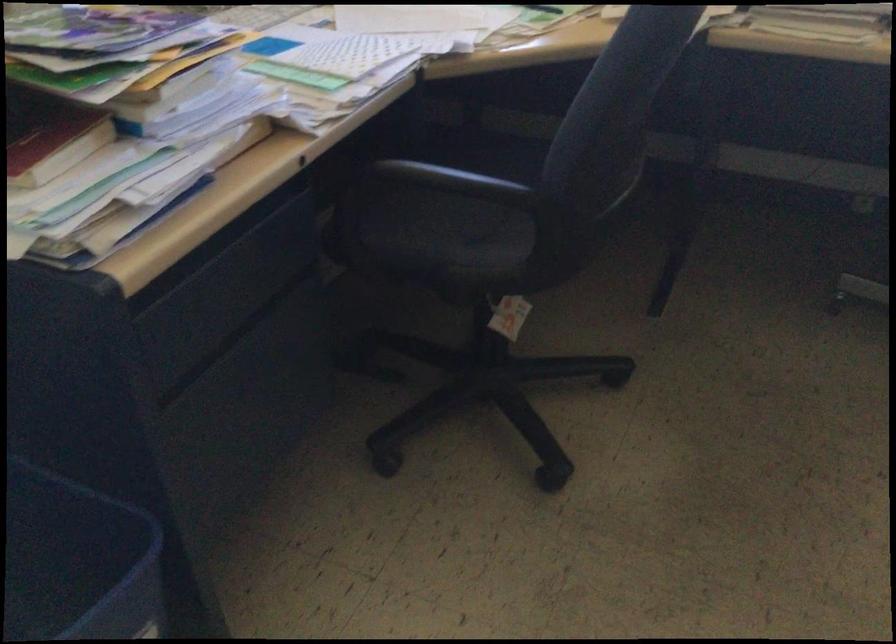
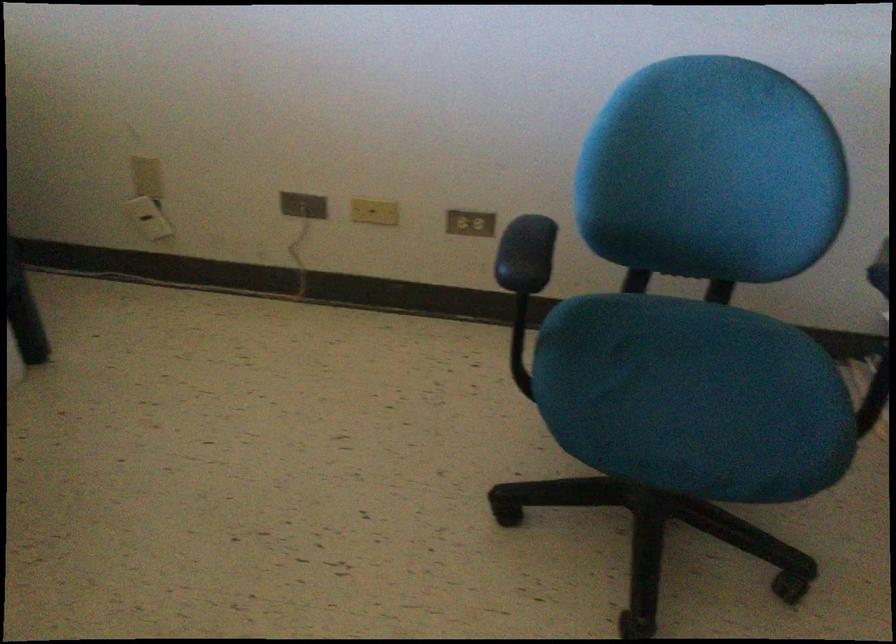
Based on the continuous images, in which direction is the camera rotating?

The rotation direction of the camera is right-down.